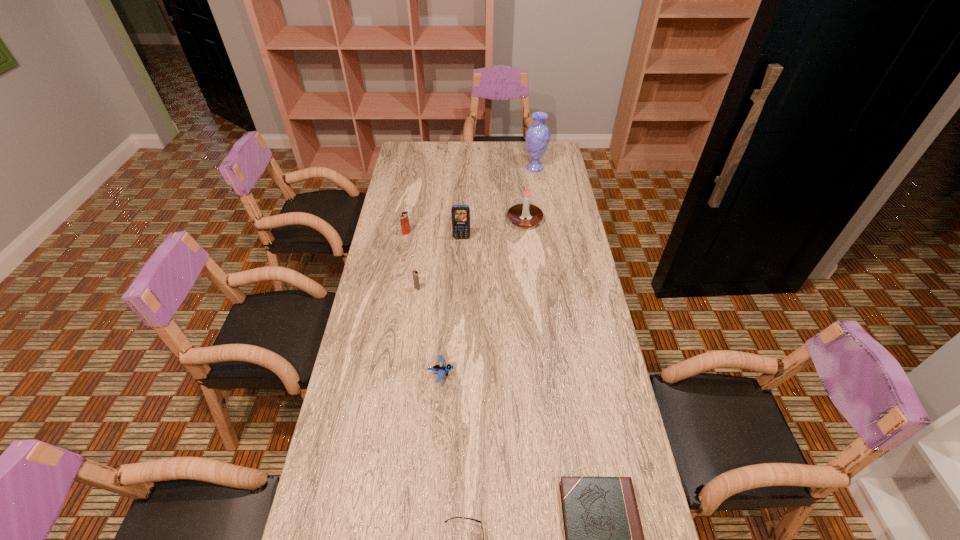
Locate which object is the third closest to the candle. Please provide its 2D coordinates. Your answer should be formatted as a tuple, i.e. [(x, y)], where the tuple contains the x and y coordinates of a point satisfying the conditions above.

[(404, 219)]

What are the coordinates of `free spot that satisfies the following two spatial constraints: 1. on the front side of the vase; 2. on the front-facing side of the sixth farthest object` in the screenshot? It's located at (567, 373).